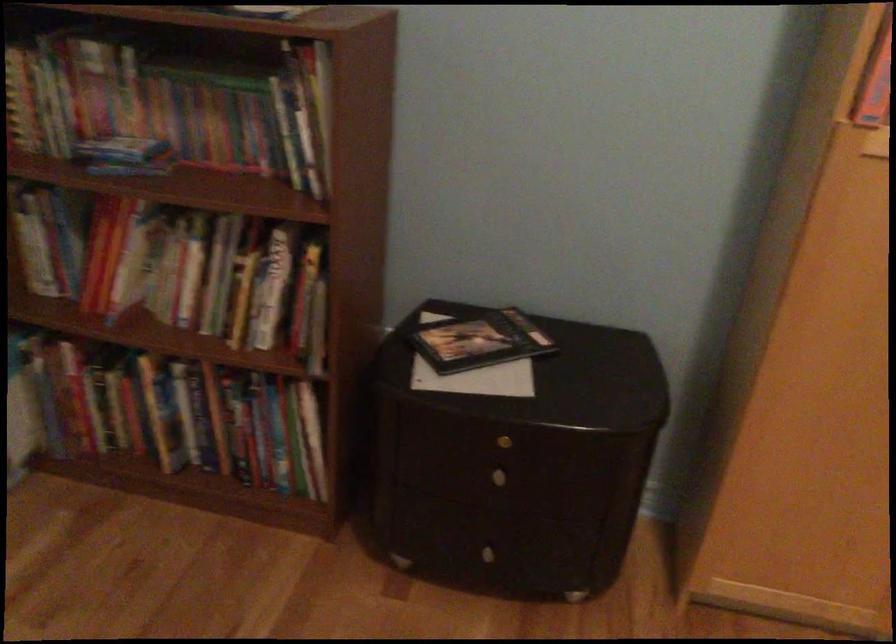
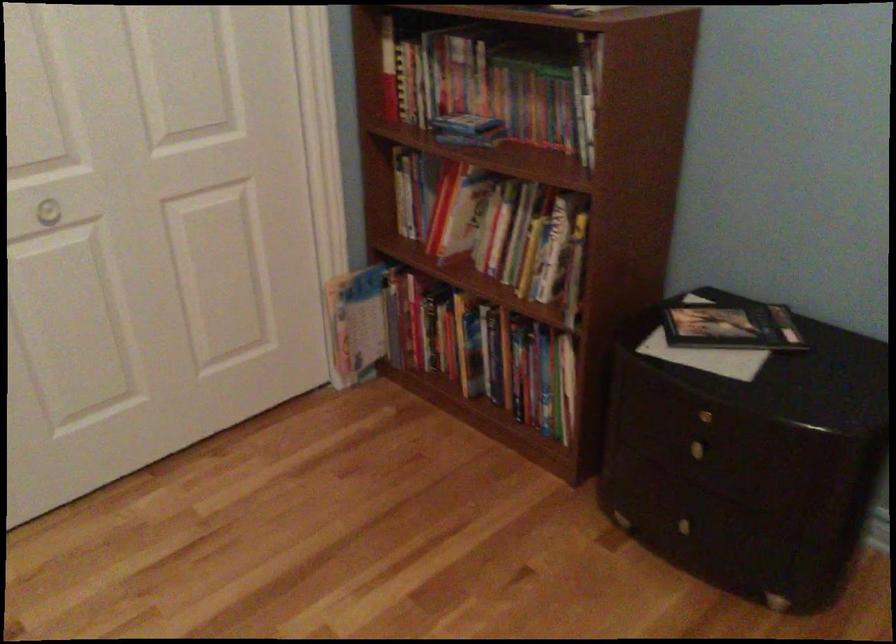
Find the pixel in the second image that matches the point at 481,480 in the first image.

(686, 450)